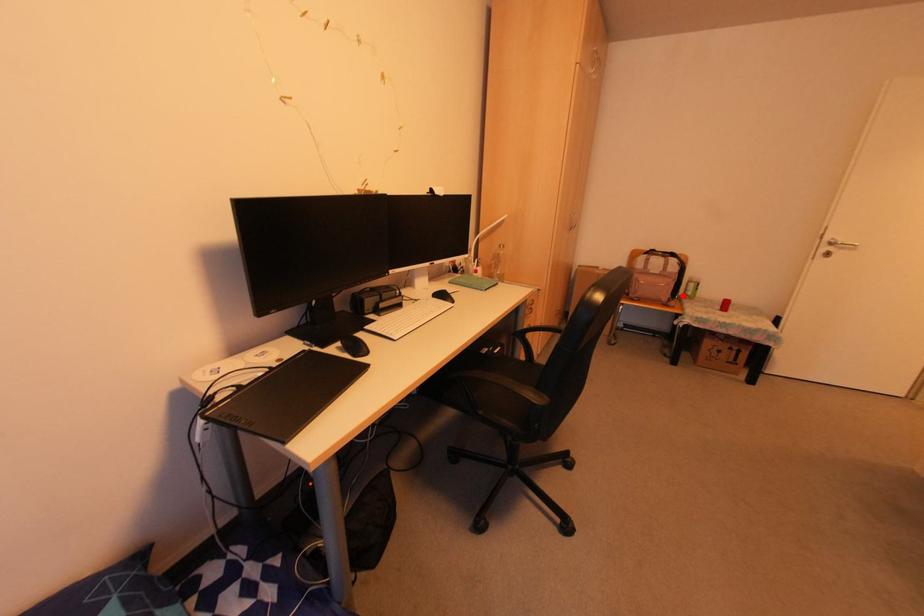
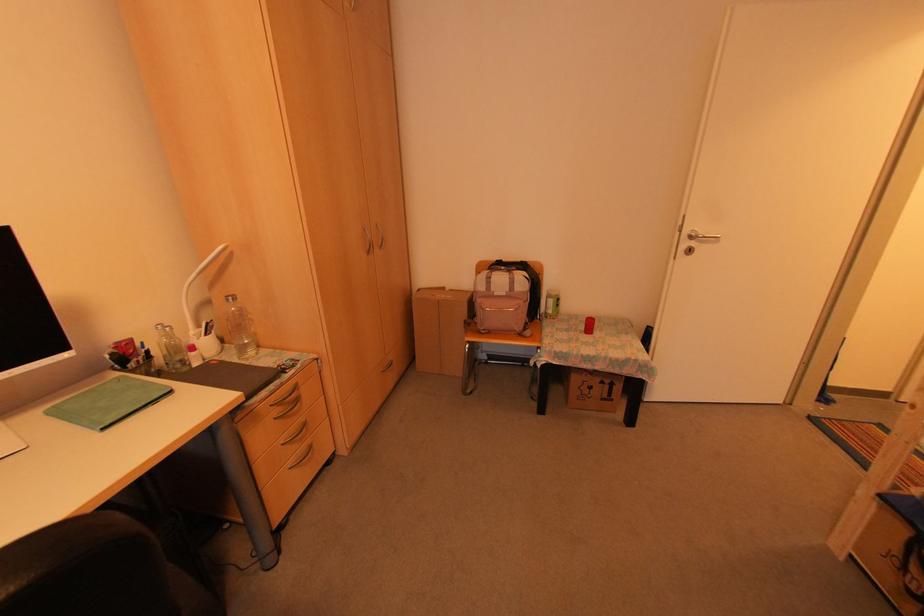
The point at the highlighted location is marked in the first image. Where is the corresponding point in the second image?

(543, 314)